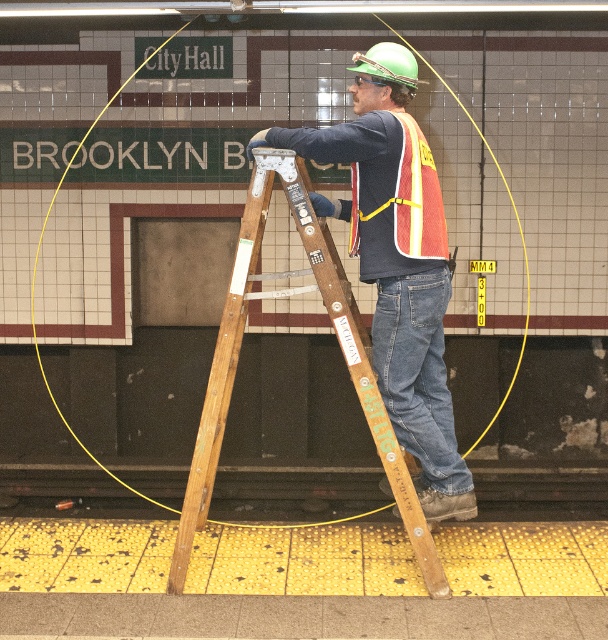
Question: Is matte orange safety vest at center smaller than wooden ladder at center?

Choices:
 (A) yes
 (B) no

Answer: (B)

Question: Can you confirm if matte orange safety vest at center is positioned to the left of wooden ladder at center?

Choices:
 (A) no
 (B) yes

Answer: (A)

Question: Is matte orange safety vest at center below wooden ladder at center?

Choices:
 (A) no
 (B) yes

Answer: (A)

Question: Which point is farther to the camera?

Choices:
 (A) matte orange safety vest at center
 (B) reflective orange safety vest at center
 (C) wooden ladder at center

Answer: (C)

Question: Which object is positioned closest to the reflective orange safety vest at center?

Choices:
 (A) matte orange safety vest at center
 (B) wooden ladder at center

Answer: (A)

Question: Which point is farther to the camera?

Choices:
 (A) matte orange safety vest at center
 (B) reflective orange safety vest at center
 (C) wooden ladder at center

Answer: (C)